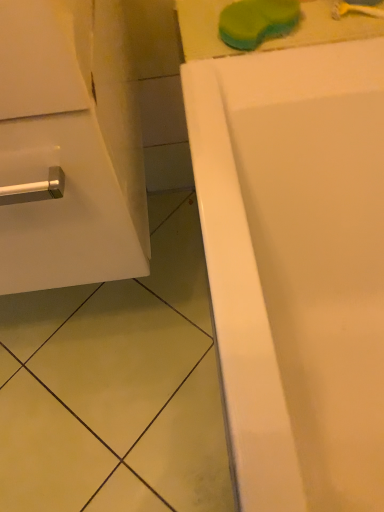
Question: Is yellow plastic toothbrush at upper right further to camera compared to white glossy cabinet at left?

Choices:
 (A) no
 (B) yes

Answer: (B)

Question: Is yellow plastic toothbrush at upper right at the left side of white glossy cabinet at left?

Choices:
 (A) no
 (B) yes

Answer: (A)

Question: From the image's perspective, is yellow plastic toothbrush at upper right beneath white glossy cabinet at left?

Choices:
 (A) no
 (B) yes

Answer: (A)

Question: From a real-world perspective, is yellow plastic toothbrush at upper right over white glossy cabinet at left?

Choices:
 (A) yes
 (B) no

Answer: (B)

Question: Is yellow plastic toothbrush at upper right not near white glossy cabinet at left?

Choices:
 (A) yes
 (B) no

Answer: (B)

Question: Is white glossy cabinet at left inside yellow plastic toothbrush at upper right?

Choices:
 (A) yes
 (B) no

Answer: (B)

Question: Can you confirm if green sponge at upper center is smaller than white glossy cabinet at left?

Choices:
 (A) no
 (B) yes

Answer: (B)

Question: Does green sponge at upper center have a greater width compared to white glossy cabinet at left?

Choices:
 (A) yes
 (B) no

Answer: (B)

Question: Are green sponge at upper center and white glossy cabinet at left making contact?

Choices:
 (A) no
 (B) yes

Answer: (A)

Question: Is green sponge at upper center bigger than white glossy cabinet at left?

Choices:
 (A) no
 (B) yes

Answer: (A)

Question: Is green sponge at upper center further to camera compared to white glossy cabinet at left?

Choices:
 (A) no
 (B) yes

Answer: (B)

Question: Is green sponge at upper center oriented towards white glossy cabinet at left?

Choices:
 (A) no
 (B) yes

Answer: (A)

Question: From a real-world perspective, does white glossy cabinet at left sit lower than green sponge at upper center?

Choices:
 (A) yes
 (B) no

Answer: (B)